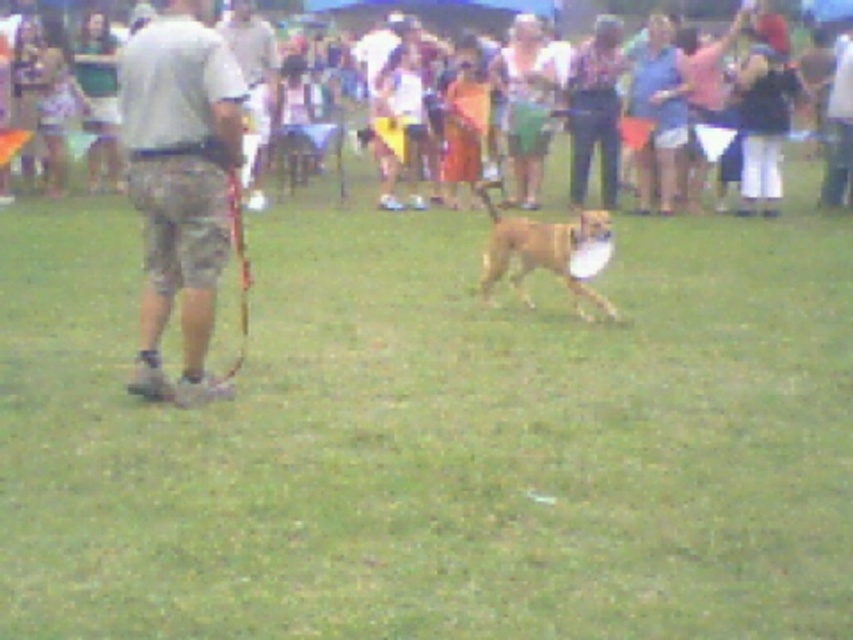
You are a photographer trying to capture the perfect shot of the matte brown dog at center. The camera has a fixed focus point at coordinates 0.02, 0.48. Will the dog be in focus?

Yes, the matte brown dog at center is located at point [410,12], which is very close to the camera focus point at [409,12]. Therefore, the dog will be in focus.

You are a dog trainer observing the scene. There are two dogs present, the matte brown dog at center and the brown furry dog at center. Which dog would you recommend for a task requiring more physical strength, based on their size?

The matte brown dog at center is bigger than the brown furry dog at center, so it would be more suitable for tasks requiring physical strength due to its larger size.